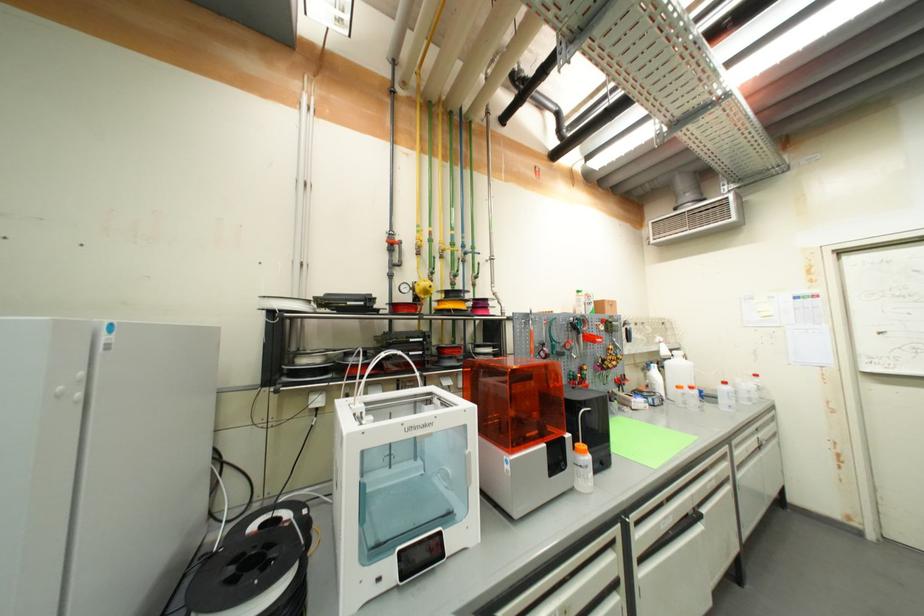
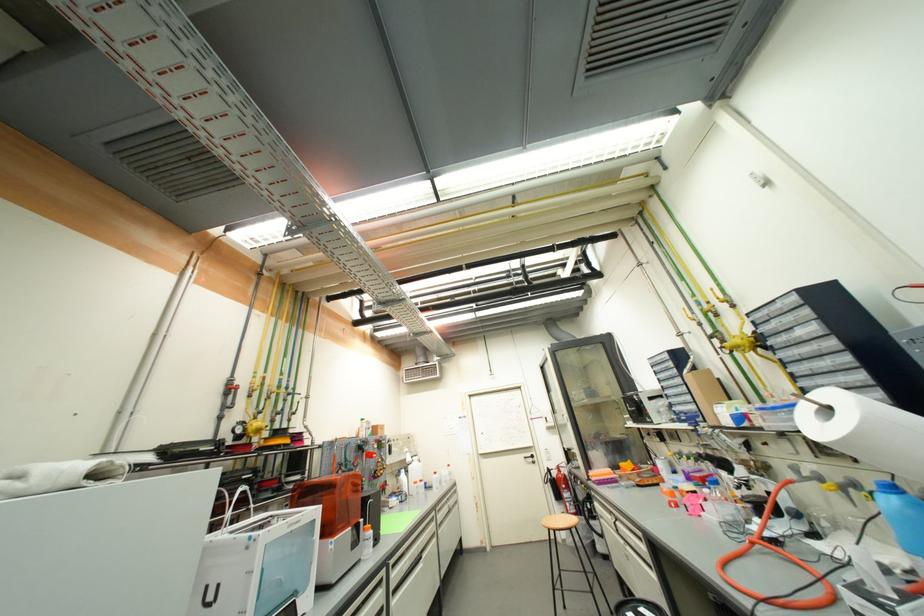
Where in the second image is the point corresponding to point (663, 353) from the first image?

(410, 461)